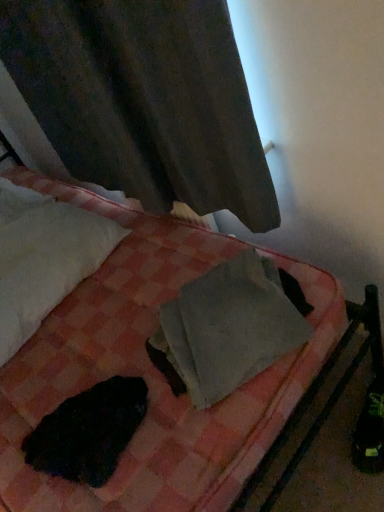
Question: Considering their positions, is black fur at lower left located in front of or behind white soft pillow at upper left?

Choices:
 (A) front
 (B) behind

Answer: (A)

Question: From a real-world perspective, relative to white soft pillow at upper left, is black fur at lower left vertically above or below?

Choices:
 (A) above
 (B) below

Answer: (B)

Question: Estimate the real-world distances between objects in this image. Which object is closer to the white soft pillow at upper left?

Choices:
 (A) pink checkered blanket at center
 (B) black fur at lower left
 (C) gray matte paper at center
 (D) matte gray curtain at upper left

Answer: (A)

Question: Which of these objects is positioned closest to the black fur at lower left?

Choices:
 (A) gray matte paper at center
 (B) matte gray curtain at upper left
 (C) pink checkered blanket at center
 (D) white soft pillow at upper left

Answer: (C)